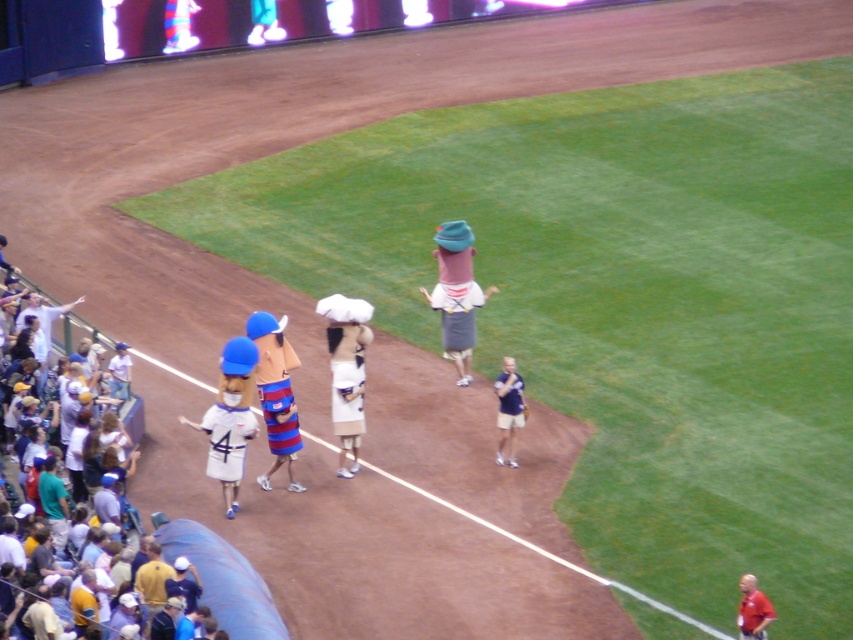
You are a spectator at the baseball stadium and see both the white matte baseball at center and the blue fabric baseball cap at center. From your viewpoint, which object is positioned more to the left?

The white matte baseball at center is positioned to the left of the blue fabric baseball cap at center, so it is more to the left.

You are a photographer standing at the edge of the baseball field. You want to take a photo of the white cotton shirt at left and the white matte baseball at center. Which object should you focus on first to ensure it appears sharp in your photo?

The white cotton shirt at left is closer to you than the white matte baseball at center, so you should focus on the white cotton shirt at left first to ensure it appears sharp in your photo.